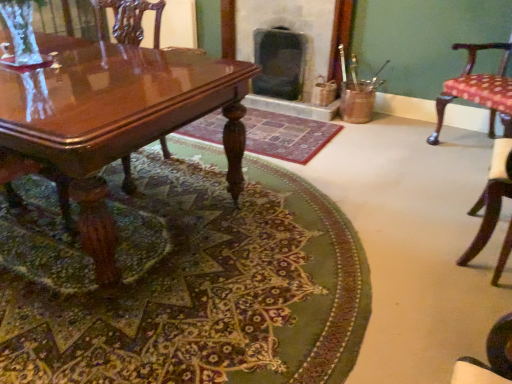
In order to click on free location to the left of polka dot fabric chair at right, the first chair positioned from the right in this screenshot , I will do `click(404, 153)`.